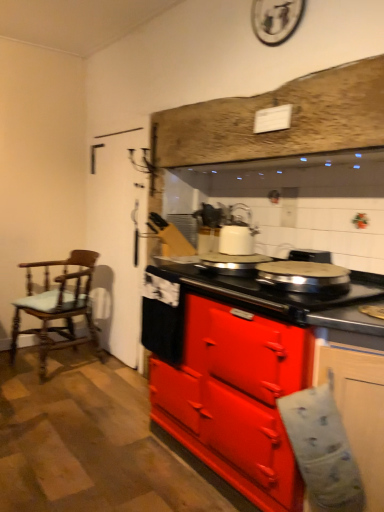
Question: From a real-world perspective, is wooden chair with cushion at left located higher than white glossy kettle at center?

Choices:
 (A) no
 (B) yes

Answer: (A)

Question: Is wooden chair with cushion at left facing towards white glossy kettle at center?

Choices:
 (A) no
 (B) yes

Answer: (A)

Question: Is the depth of wooden chair with cushion at left greater than that of white glossy kettle at center?

Choices:
 (A) no
 (B) yes

Answer: (B)

Question: Is wooden chair with cushion at left placed right next to white glossy kettle at center?

Choices:
 (A) no
 (B) yes

Answer: (A)

Question: Considering the relative sizes of wooden chair with cushion at left and white glossy kettle at center in the image provided, is wooden chair with cushion at left shorter than white glossy kettle at center?

Choices:
 (A) yes
 (B) no

Answer: (B)

Question: Does point (67, 294) appear closer or farther from the camera than point (241, 251)?

Choices:
 (A) closer
 (B) farther

Answer: (B)

Question: Considering the positions of wooden chair with cushion at left and white glossy kettle at center in the image, is wooden chair with cushion at left taller or shorter than white glossy kettle at center?

Choices:
 (A) tall
 (B) short

Answer: (A)

Question: From a real-world perspective, is wooden chair with cushion at left positioned above or below white glossy kettle at center?

Choices:
 (A) above
 (B) below

Answer: (B)

Question: In terms of size, does wooden chair with cushion at left appear bigger or smaller than white glossy kettle at center?

Choices:
 (A) small
 (B) big

Answer: (B)

Question: From the image's perspective, is matte red stove at center, acting as the first cabinetry starting from the back, positioned above or below matte white cabinet at lower right, placed as the second cabinetry when sorted from back to front?

Choices:
 (A) below
 (B) above

Answer: (B)

Question: In the image, is matte red stove at center, acting as the first cabinetry starting from the back, positioned in front of or behind matte white cabinet at lower right, which is the first cabinetry from front to back?

Choices:
 (A) behind
 (B) front

Answer: (A)

Question: Is matte red stove at center, positioned as the 2th cabinetry in front-to-back order, bigger or smaller than matte white cabinet at lower right, placed as the second cabinetry when sorted from back to front?

Choices:
 (A) small
 (B) big

Answer: (B)

Question: Is matte red stove at center, acting as the first cabinetry starting from the back, wider or thinner than matte white cabinet at lower right, which is the first cabinetry from front to back?

Choices:
 (A) wide
 (B) thin

Answer: (A)

Question: Is point (198, 345) closer or farther from the camera than point (223, 250)?

Choices:
 (A) farther
 (B) closer

Answer: (B)

Question: From a real-world perspective, relative to white glossy kettle at center, is matte red stove at center, positioned as the 2th cabinetry in front-to-back order, vertically above or below?

Choices:
 (A) above
 (B) below

Answer: (B)